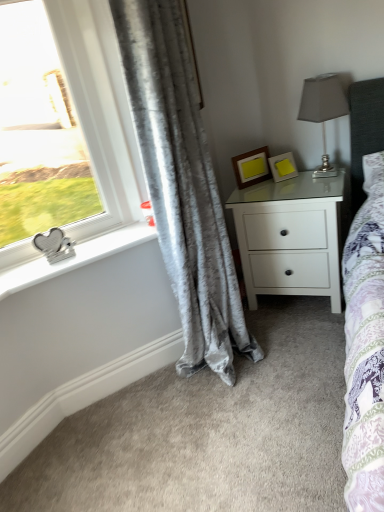
Question: Should I look upward or downward to see wooden picture frame at center, which is the first picture frame from left to right?

Choices:
 (A) up
 (B) down

Answer: (A)

Question: Considering the relative sizes of silver metallic heart-shaped object at left and satin silver table lamp at upper right in the image provided, is silver metallic heart-shaped object at left thinner than satin silver table lamp at upper right?

Choices:
 (A) no
 (B) yes

Answer: (B)

Question: Is silver metallic heart-shaped object at left aimed at satin silver table lamp at upper right?

Choices:
 (A) no
 (B) yes

Answer: (A)

Question: Does silver metallic heart-shaped object at left touch satin silver table lamp at upper right?

Choices:
 (A) yes
 (B) no

Answer: (B)

Question: Does silver metallic heart-shaped object at left come in front of satin silver table lamp at upper right?

Choices:
 (A) yes
 (B) no

Answer: (A)

Question: Considering the relative sizes of silver metallic heart-shaped object at left and satin silver table lamp at upper right in the image provided, is silver metallic heart-shaped object at left wider than satin silver table lamp at upper right?

Choices:
 (A) no
 (B) yes

Answer: (A)

Question: Is silver metallic heart-shaped object at left turned away from satin silver table lamp at upper right?

Choices:
 (A) yes
 (B) no

Answer: (B)

Question: Would you say silver metallic heart-shaped object at left is part of velvet gray curtain at left's contents?

Choices:
 (A) no
 (B) yes

Answer: (A)

Question: Is velvet gray curtain at left facing away from silver metallic heart-shaped object at left?

Choices:
 (A) yes
 (B) no

Answer: (A)

Question: Can you confirm if velvet gray curtain at left is wider than silver metallic heart-shaped object at left?

Choices:
 (A) yes
 (B) no

Answer: (A)

Question: Considering the relative positions of velvet gray curtain at left and silver metallic heart-shaped object at left in the image provided, is velvet gray curtain at left to the left of silver metallic heart-shaped object at left from the viewer's perspective?

Choices:
 (A) no
 (B) yes

Answer: (A)

Question: Considering the relative sizes of velvet gray curtain at left and silver metallic heart-shaped object at left in the image provided, is velvet gray curtain at left taller than silver metallic heart-shaped object at left?

Choices:
 (A) yes
 (B) no

Answer: (A)

Question: Can you see velvet gray curtain at left touching silver metallic heart-shaped object at left?

Choices:
 (A) yes
 (B) no

Answer: (B)

Question: Considering the relative sizes of wooden picture frame at center, which is the first picture frame from left to right, and white matte nightstand at center-right in the image provided, is wooden picture frame at center, which is the first picture frame from left to right, smaller than white matte nightstand at center-right?

Choices:
 (A) yes
 (B) no

Answer: (A)